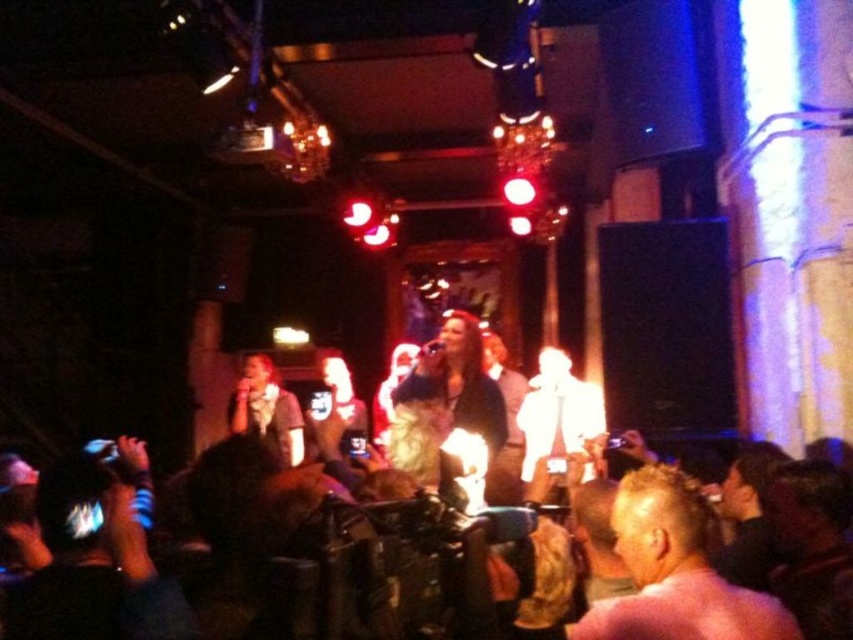
Does shiny gold jacket at center have a smaller size compared to white glossy microphone at center?

Correct, shiny gold jacket at center occupies less space than white glossy microphone at center.

Which is more to the left, shiny gold jacket at center or white glossy microphone at center?

From the viewer's perspective, shiny gold jacket at center appears more on the left side.

Where is `shiny gold jacket at center`? The width and height of the screenshot is (853, 640). shiny gold jacket at center is located at coordinates (445, 400).

Is white glossy microphone at center shorter than matte gray shirt at center?

In fact, white glossy microphone at center may be taller than matte gray shirt at center.

Does white glossy microphone at center lie behind matte gray shirt at center?

No.

Find the location of `white glossy microphone at center`. white glossy microphone at center is located at coordinates (555, 417).

What are the coordinates of `white glossy microphone at center` in the screenshot? It's located at (555, 417).

Can you confirm if shiny gold jacket at center is shorter than matte gray shirt at center?

Yes.

Who is positioned more to the left, shiny gold jacket at center or matte gray shirt at center?

matte gray shirt at center is more to the left.

Who is more distant from viewer, [425,468] or [254,413]?

The point [254,413] is more distant.

This screenshot has height=640, width=853. Identify the location of shiny gold jacket at center. (445, 400).